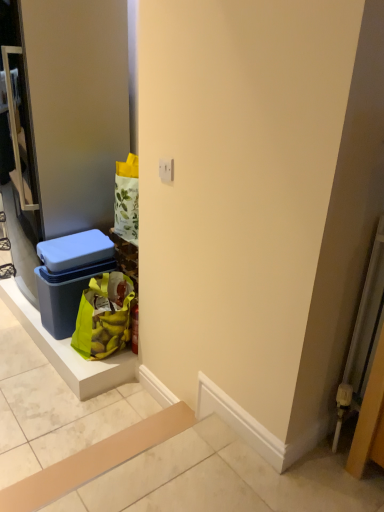
Question: From a real-world perspective, is green fabric shopping bag at lower left on blue plastic storage box at left?

Choices:
 (A) no
 (B) yes

Answer: (A)

Question: Considering the relative positions of green fabric shopping bag at lower left and blue plastic storage box at left in the image provided, is green fabric shopping bag at lower left to the right of blue plastic storage box at left from the viewer's perspective?

Choices:
 (A) no
 (B) yes

Answer: (B)

Question: From a real-world perspective, is green fabric shopping bag at lower left below blue plastic storage box at left?

Choices:
 (A) no
 (B) yes

Answer: (B)

Question: From the image's perspective, is green fabric shopping bag at lower left on blue plastic storage box at left?

Choices:
 (A) no
 (B) yes

Answer: (A)

Question: Is green fabric shopping bag at lower left at the left side of blue plastic storage box at left?

Choices:
 (A) yes
 (B) no

Answer: (B)

Question: Is green fabric shopping bag at lower left to the left or to the right of blue plastic door at left in the image?

Choices:
 (A) left
 (B) right

Answer: (B)

Question: In terms of height, does green fabric shopping bag at lower left look taller or shorter compared to blue plastic door at left?

Choices:
 (A) short
 (B) tall

Answer: (A)

Question: From the image's perspective, is green fabric shopping bag at lower left above or below blue plastic door at left?

Choices:
 (A) below
 (B) above

Answer: (A)

Question: Looking at the image, does green fabric shopping bag at lower left seem bigger or smaller compared to blue plastic door at left?

Choices:
 (A) big
 (B) small

Answer: (B)

Question: In the image, is blue plastic door at left on the left side or the right side of green fabric shopping bag at lower left?

Choices:
 (A) left
 (B) right

Answer: (A)

Question: Is blue plastic door at left situated inside green fabric shopping bag at lower left or outside?

Choices:
 (A) outside
 (B) inside

Answer: (A)

Question: Is point (62, 103) positioned closer to the camera than point (79, 301)?

Choices:
 (A) closer
 (B) farther

Answer: (A)

Question: In terms of width, does blue plastic door at left look wider or thinner when compared to green fabric shopping bag at lower left?

Choices:
 (A) wide
 (B) thin

Answer: (A)

Question: Considering the positions of green fabric shopping bag at lower left and blue plastic storage box at left in the image, is green fabric shopping bag at lower left wider or thinner than blue plastic storage box at left?

Choices:
 (A) thin
 (B) wide

Answer: (A)

Question: Considering the positions of point (102, 330) and point (72, 306), is point (102, 330) closer or farther from the camera than point (72, 306)?

Choices:
 (A) closer
 (B) farther

Answer: (A)